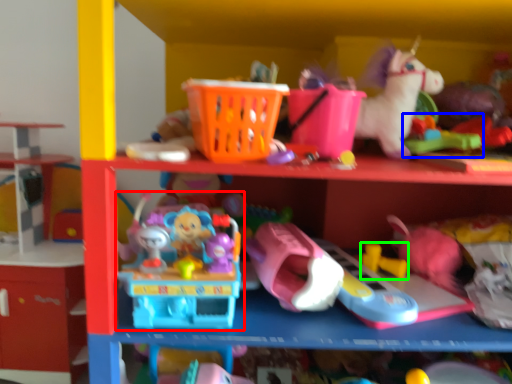
Question: Based on their relative distances, which object is nearer to toy (highlighted by a red box)? Choose from toy (highlighted by a blue box) and toy (highlighted by a green box).

Choices:
 (A) toy
 (B) toy

Answer: (B)